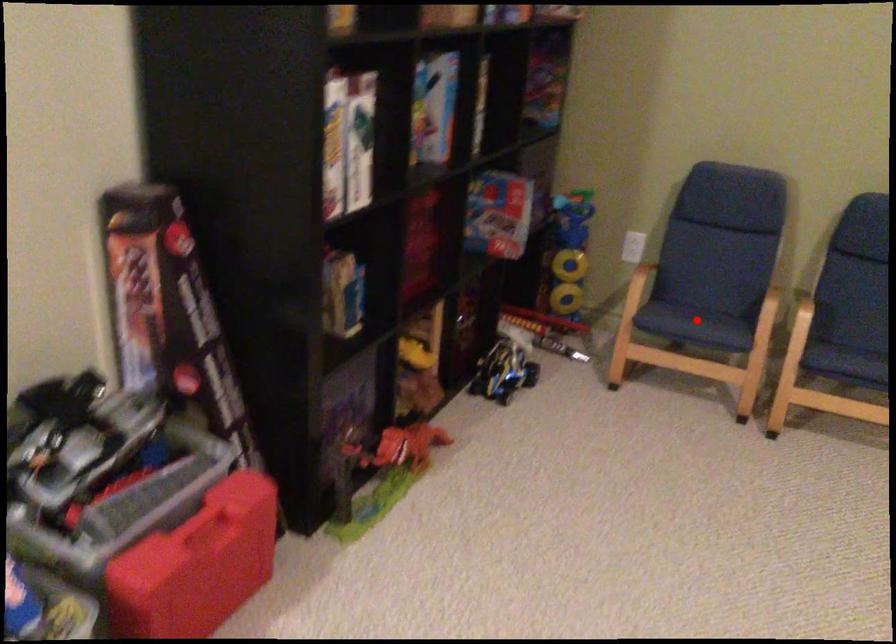
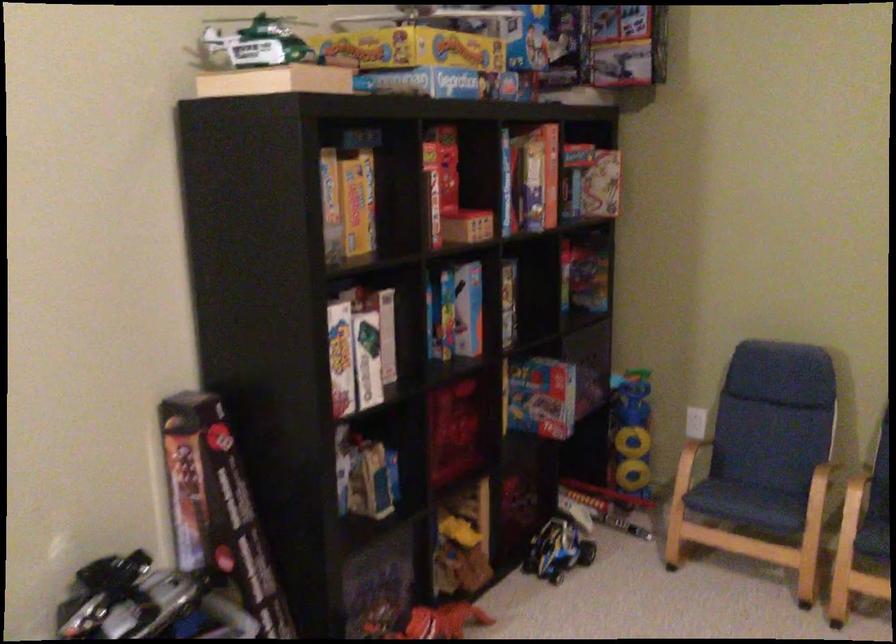
Find the pixel in the second image that matches the highlighted location in the first image.

(747, 500)